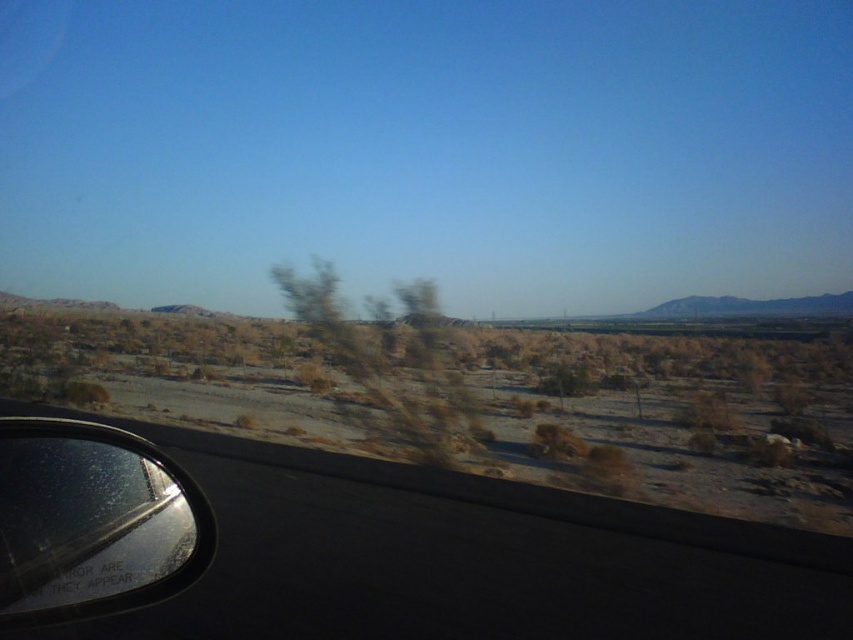
You are a driver in a car and you want to know the location of the brown sandy desert at lower left. What are its coordinates?

The brown sandy desert at lower left is located at coordinates point (679, 413).

You are inside the car and looking out the side window. You see two points marked on the window. The first point is at coordinate point (x=709, y=484) and the second is at point (x=80, y=492). Which point is closer to the horizon?

Point (x=80, y=492) is closer to the horizon because it is in front of point (x=709, y=484).